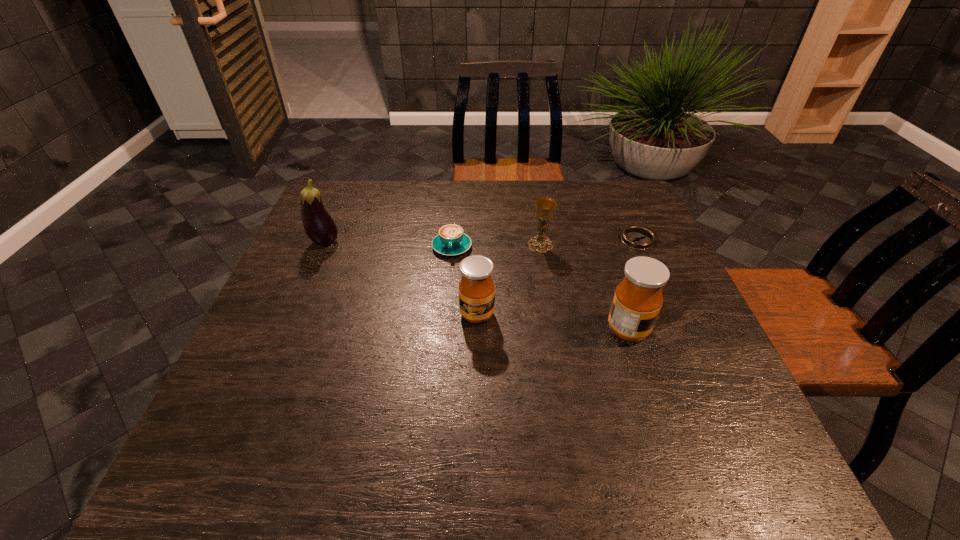
Where is `the left honey`? the left honey is located at coordinates (476, 289).

Find the location of a particular element. the fifth object from left to right is located at coordinates (638, 298).

Locate an element on the screen. The height and width of the screenshot is (540, 960). the taller honey is located at coordinates (638, 298).

Where is `the shortest object`? This screenshot has width=960, height=540. the shortest object is located at coordinates (639, 238).

This screenshot has width=960, height=540. In order to click on the rightmost object in this screenshot , I will do `click(639, 238)`.

You are a GUI agent. You are given a task and a screenshot of the screen. Output one action in this format:
    pyautogui.click(x=<x>, y=<y>)
    Task: Click on the chalice
    The height and width of the screenshot is (540, 960).
    Given the screenshot: What is the action you would take?
    pyautogui.click(x=545, y=207)

At what (x,y) coordinates should I click in order to perform the action: click on the second shortest object. Please return your answer as a coordinate pair (x, y). This screenshot has height=540, width=960. Looking at the image, I should click on (451, 240).

Image resolution: width=960 pixels, height=540 pixels. Find the location of `eggplant`. eggplant is located at coordinates (319, 226).

At what (x,y) coordinates should I click in order to perform the action: click on vacant space positioned on the front-facing side of the shorter honey. Please return your answer as a coordinate pair (x, y). The height and width of the screenshot is (540, 960). Looking at the image, I should click on (477, 348).

Locate an element on the screen. vacant space located 0.130m on the front-facing side of the right honey is located at coordinates (708, 330).